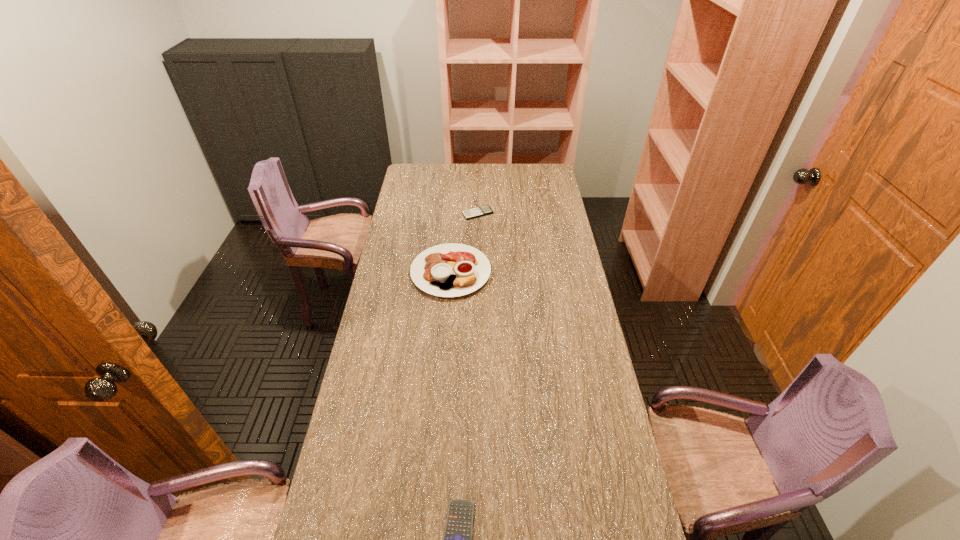
Where is `free space at the far right corner`? free space at the far right corner is located at coordinates (550, 183).

You are a GUI agent. You are given a task and a screenshot of the screen. Output one action in this format:
    pyautogui.click(x=<x>, y=<y>)
    Task: Click on the blank region between the second shortest object and the second farthest object
    
    Given the screenshot: What is the action you would take?
    pyautogui.click(x=465, y=243)

In order to click on vacant point located between the farthest object and the tallest object in this screenshot , I will do `click(465, 243)`.

I want to click on vacant space that's between the platter and the taller calculator, so click(465, 243).

Identify the location of empty location between the taller calculator and the second nearest object. (465, 243).

The height and width of the screenshot is (540, 960). In order to click on vacant point located between the farther calculator and the platter in this screenshot , I will do `click(465, 243)`.

Identify which object is located as the second nearest to the farther calculator. Please provide its 2D coordinates. Your answer should be formatted as a tuple, i.e. [(x, y)], where the tuple contains the x and y coordinates of a point satisfying the conditions above.

[(457, 539)]

Locate which object ranks second in proximity to the second tallest object. Please provide its 2D coordinates. Your answer should be formatted as a tuple, i.e. [(x, y)], where the tuple contains the x and y coordinates of a point satisfying the conditions above.

[(457, 539)]

This screenshot has width=960, height=540. Identify the location of vacant space that satisfies the following two spatial constraints: 1. on the back side of the tallest object; 2. on the left side of the taller calculator. (455, 213).